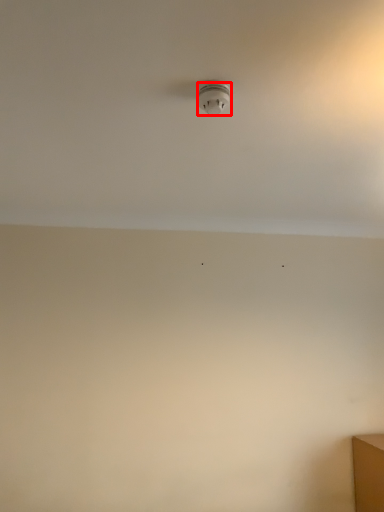
Question: From the image's perspective, considering the relative positions of light fixture (annotated by the red box) and backdrop in the image provided, where is light fixture (annotated by the red box) located with respect to the staircase?

Choices:
 (A) below
 (B) above

Answer: (B)